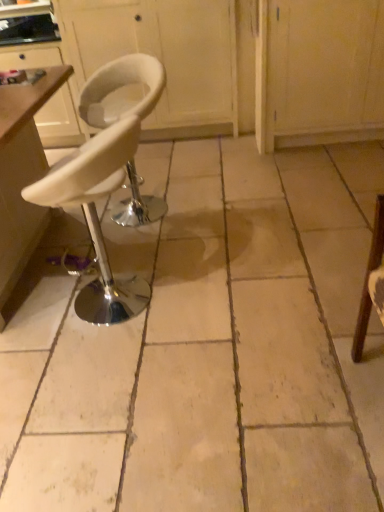
The image size is (384, 512). In order to click on unoccupied region to the right of white matte stool at center, the second chair in the front-to-back sequence in this screenshot , I will do `click(211, 201)`.